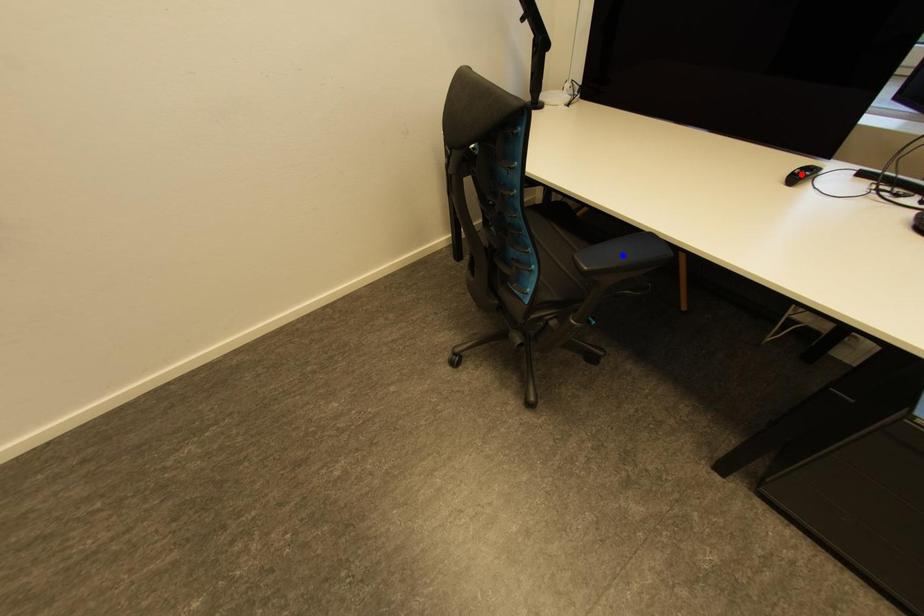
Question: Two points are marked on the image. Which point is closer to the camera?

Choices:
 (A) Blue point is closer.
 (B) Red point is closer.

Answer: (A)